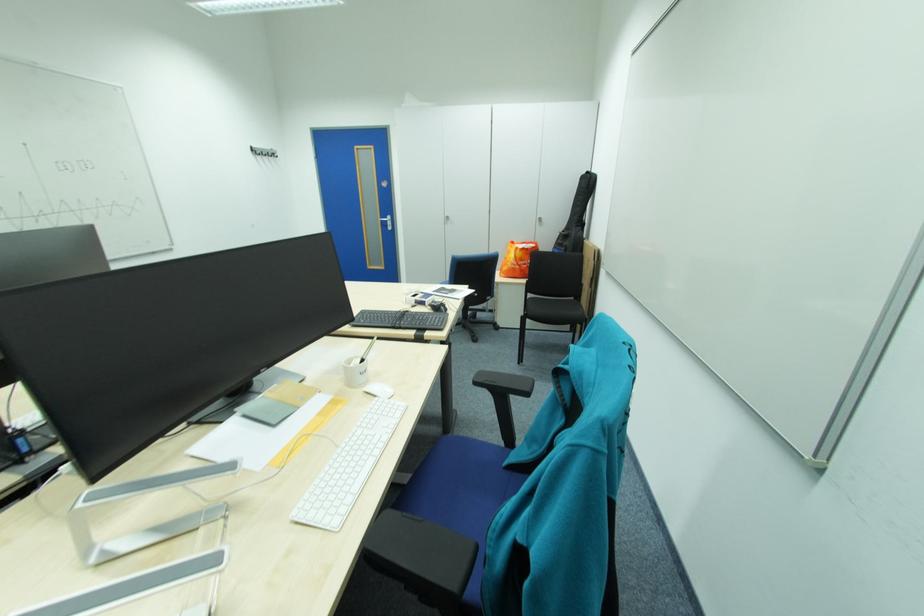
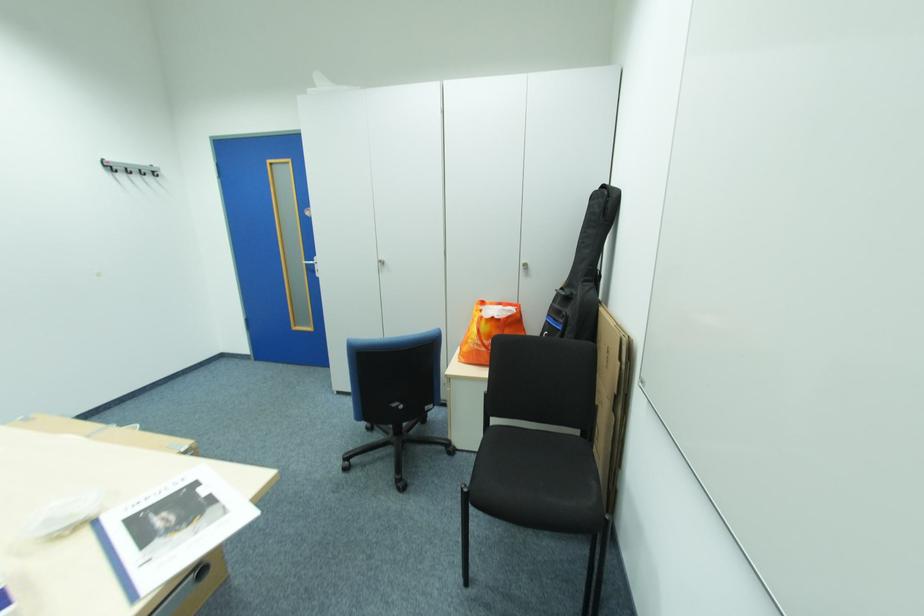
Where in the second image is the point corresponding to [262,153] from the first image?

(114, 171)